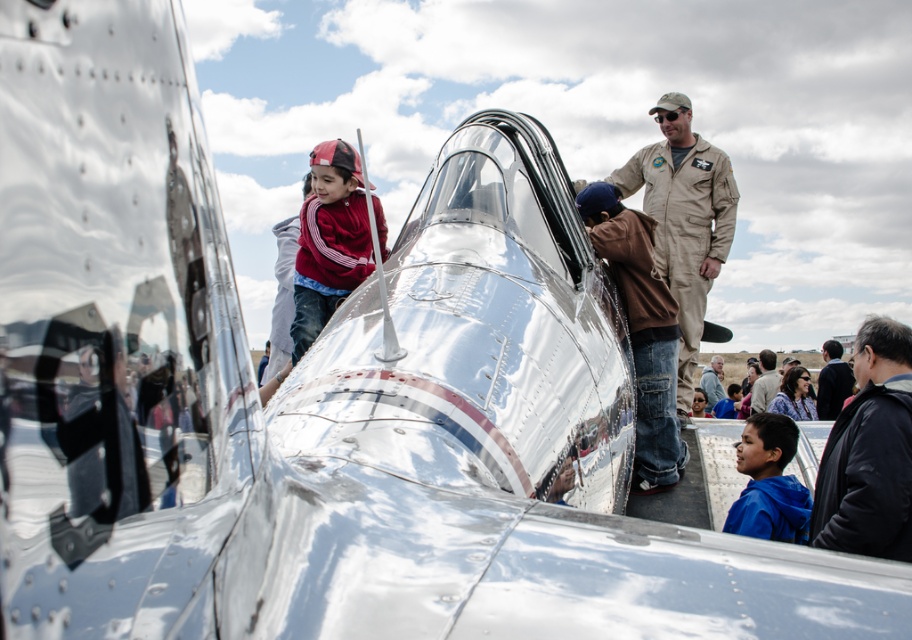
Does point (765, 502) come in front of point (765, 396)?

That is True.

Can you confirm if blue fleece jacket at lower right is bigger than dark brown leather jacket at lower right?

Actually, blue fleece jacket at lower right might be smaller than dark brown leather jacket at lower right.

Between point (775, 476) and point (762, 388), which one is positioned in front?

Point (775, 476) is more forward.

This screenshot has width=912, height=640. I want to click on blue fleece jacket at lower right, so click(x=769, y=483).

Is dark gray jacket at lower right below dark brown leather jacket at lower right?

Actually, dark gray jacket at lower right is above dark brown leather jacket at lower right.

Is dark gray jacket at lower right positioned in front of dark brown leather jacket at lower right?

Yes, dark gray jacket at lower right is closer to the viewer.

The image size is (912, 640). Identify the location of dark gray jacket at lower right. (832, 381).

Identify the location of dark gray jacket at lower right. Image resolution: width=912 pixels, height=640 pixels. (832, 381).

Is point (890, 513) in front of point (830, 342)?

Yes, it is.

Between black leather jacket at lower right and dark gray jacket at lower right, which one is positioned lower?

dark gray jacket at lower right is lower down.

Measure the distance between black leather jacket at lower right and camera.

black leather jacket at lower right and camera are 2.36 meters apart from each other.

Where is `black leather jacket at lower right`? Image resolution: width=912 pixels, height=640 pixels. black leather jacket at lower right is located at coordinates (869, 452).